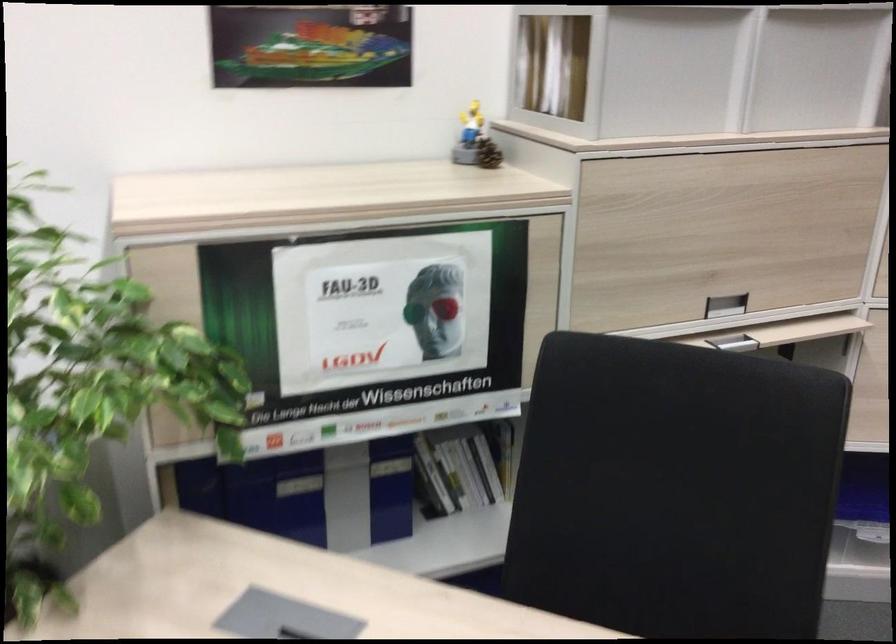
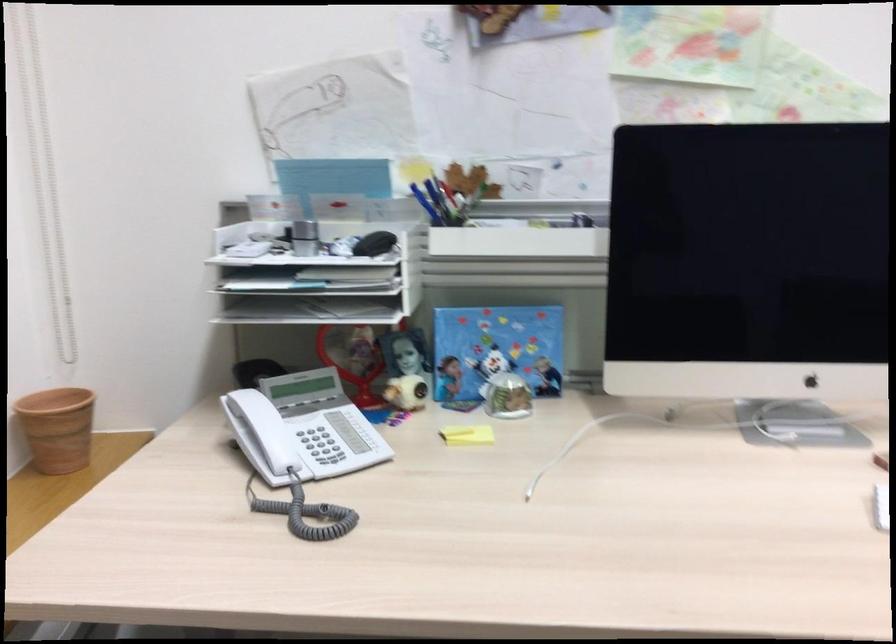
Question: What movement of the cameraman would produce the second image?

Choices:
 (A) Left
 (B) Right
 (C) Forward
 (D) Backward

Answer: (A)